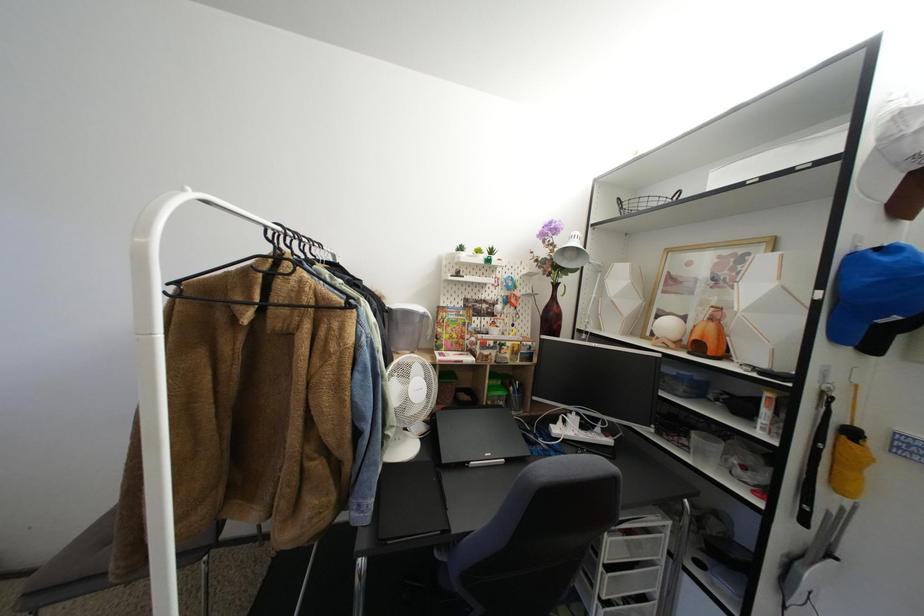
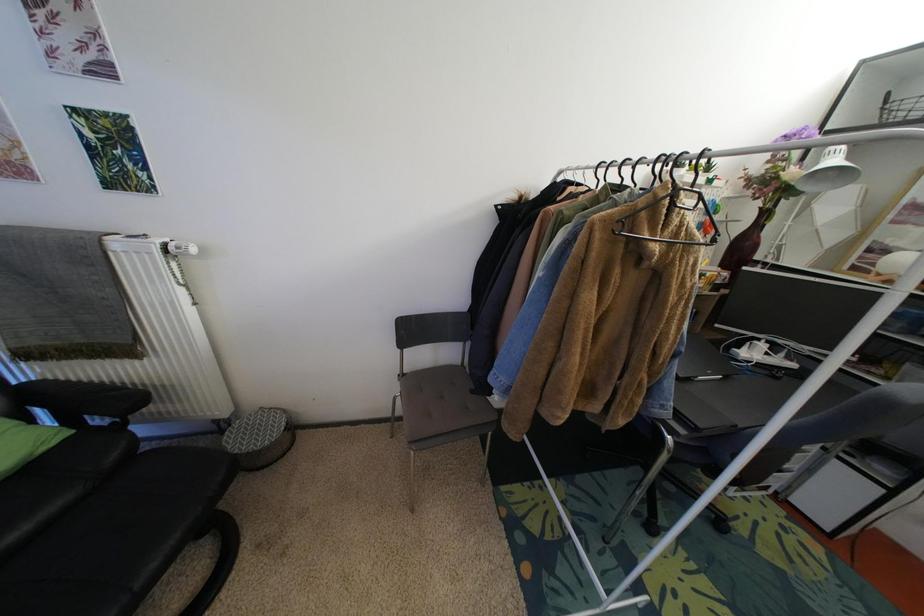
Question: How did the camera likely rotate?

Choices:
 (A) Left
 (B) Right
 (C) Up
 (D) Down

Answer: (D)